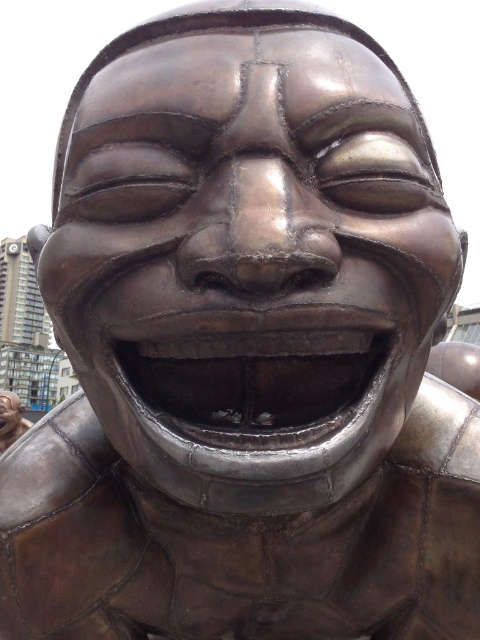
Can you confirm if shiny metallic mouth at center is taller than bronze statue at lower left?

In fact, shiny metallic mouth at center may be shorter than bronze statue at lower left.

Who is higher up, shiny metallic mouth at center or bronze statue at lower left?

shiny metallic mouth at center is higher up.

Which is behind, point (261, 404) or point (19, 408)?

Point (19, 408)

Locate an element on the screen. shiny metallic mouth at center is located at coordinates (257, 381).